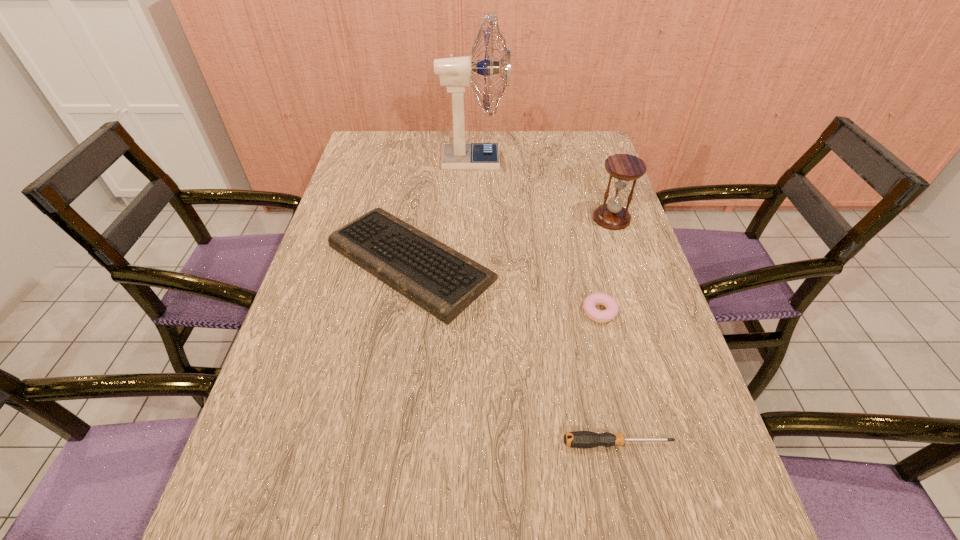
You are a GUI agent. You are given a task and a screenshot of the screen. Output one action in this format:
    pyautogui.click(x=<x>, y=<y>)
    Task: Click on the tallest object
    This screenshot has height=540, width=960.
    Given the screenshot: What is the action you would take?
    pyautogui.click(x=455, y=73)

Where is `the farthest object`? The height and width of the screenshot is (540, 960). the farthest object is located at coordinates (455, 73).

You are a GUI agent. You are given a task and a screenshot of the screen. Output one action in this format:
    pyautogui.click(x=<x>, y=<y>)
    Task: Click on the hourglass
    The width and height of the screenshot is (960, 540).
    Given the screenshot: What is the action you would take?
    pyautogui.click(x=623, y=167)

At what (x,y) coordinates should I click in order to perform the action: click on the third shortest object. Please return your answer as a coordinate pair (x, y). The height and width of the screenshot is (540, 960). Looking at the image, I should click on (444, 282).

Where is `doughnut`? Image resolution: width=960 pixels, height=540 pixels. doughnut is located at coordinates (612, 308).

Find the location of a particular element. The image size is (960, 540). screwdriver is located at coordinates (579, 439).

Where is `free location located 0.220m on the front-facing side of the tallest object`? free location located 0.220m on the front-facing side of the tallest object is located at coordinates (569, 160).

Find the location of `vacant space positioned 0.360m on the back of the hourglass`. vacant space positioned 0.360m on the back of the hourglass is located at coordinates (588, 146).

In order to click on free space located 0.340m on the front of the computer keyboard in this screenshot , I will do `click(377, 478)`.

You are a GUI agent. You are given a task and a screenshot of the screen. Output one action in this format:
    pyautogui.click(x=<x>, y=<y>)
    Task: Click on the vacant region located 0.070m on the left of the doughnut
    
    Given the screenshot: What is the action you would take?
    pyautogui.click(x=552, y=312)